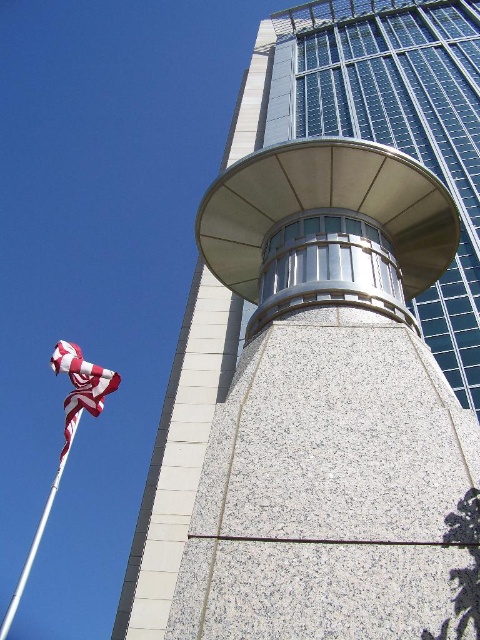
Is striped fabric flag at left bigger than white glossy flag pole at lower left?

No.

Who is more forward, (67, 349) or (13, 605)?

Point (67, 349)

Measure the distance between point (x=75, y=410) and camera.

Point (x=75, y=410) is 79.58 feet from camera.

Identify the location of striped fabric flag at left. (81, 387).